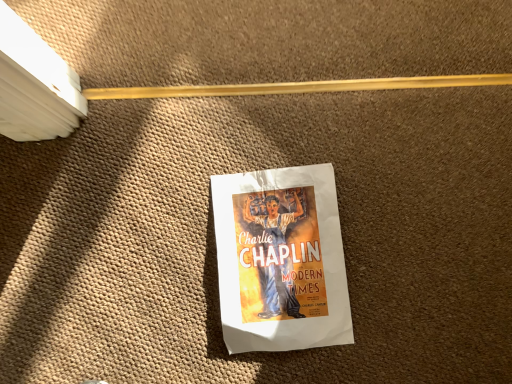
Locate an element on the screen. This screenshot has height=384, width=512. vacant area on top of white paper poster at center (from a real-world perspective) is located at coordinates (284, 254).